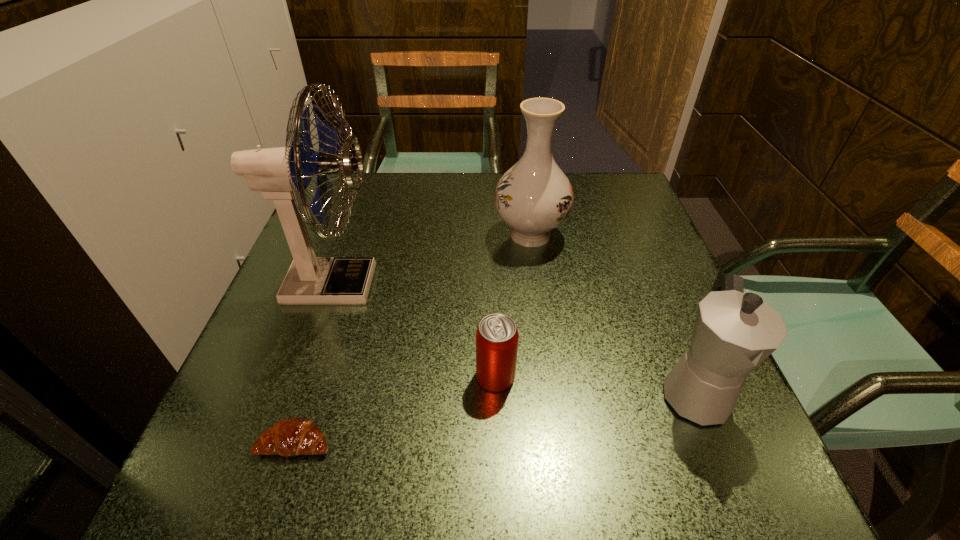
Image resolution: width=960 pixels, height=540 pixels. Identify the location of vacant space at the far left corner. (338, 201).

Identify the location of vacant space at the near left corner of the desktop. (252, 456).

The width and height of the screenshot is (960, 540). What are the coordinates of `blank space at the far right corner of the desktop` in the screenshot? It's located at (582, 183).

The width and height of the screenshot is (960, 540). What are the coordinates of `free space between the rightmost object and the crescent roll` in the screenshot? It's located at (494, 417).

Find the location of `free area in between the coffeepot and the fourth tallest object`. free area in between the coffeepot and the fourth tallest object is located at coordinates (595, 384).

I want to click on unoccupied position between the fourth tallest object and the crescent roll, so click(396, 409).

At what (x,y) coordinates should I click in order to perform the action: click on blank region between the shortest object and the rightmost object. Please return your answer as a coordinate pair (x, y). Image resolution: width=960 pixels, height=540 pixels. Looking at the image, I should click on (494, 417).

Find the location of a particular element. unoccupied position between the crescent roll and the fourth tallest object is located at coordinates (396, 409).

Where is `unoccupied position between the vase and the second shortest object`? The image size is (960, 540). unoccupied position between the vase and the second shortest object is located at coordinates (513, 306).

Locate an element on the screen. free space between the vase and the fan is located at coordinates (432, 260).